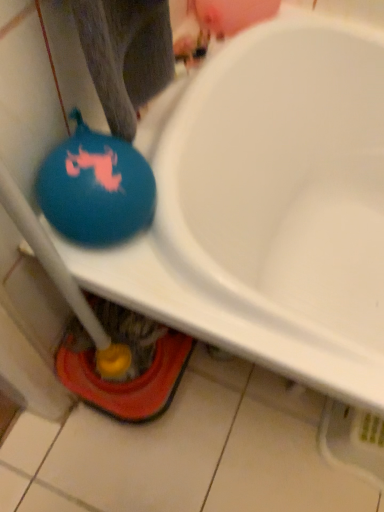
Question: Should I look upward or downward to see blue rubber balloon at left?

Choices:
 (A) down
 (B) up

Answer: (B)